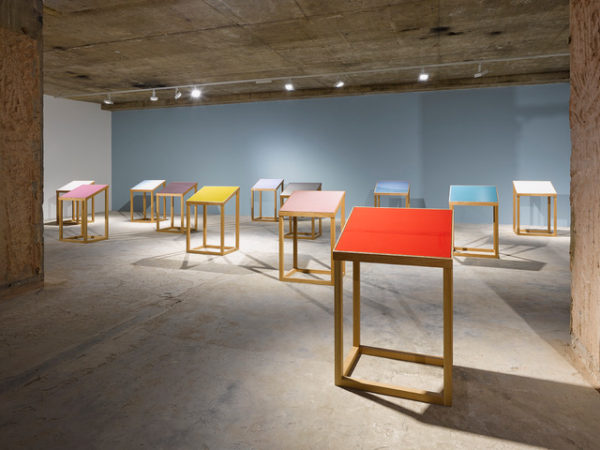
This screenshot has width=600, height=450. Find the location of `wooden legs`. wooden legs is located at coordinates (334, 316), (360, 300), (444, 302).